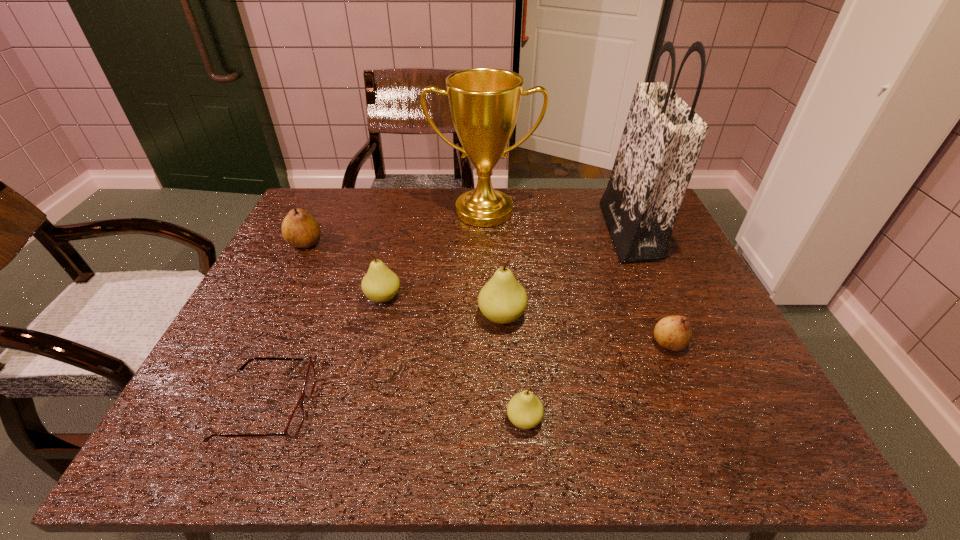
The image size is (960, 540). Find the location of `object identified as the closest to the award`. object identified as the closest to the award is located at coordinates pyautogui.click(x=662, y=139).

Locate an element on the screen. object that is the fifth nearest to the smallest green pear is located at coordinates (662, 139).

You are a GUI agent. You are given a task and a screenshot of the screen. Output one action in this format:
    pyautogui.click(x=<x>, y=<y>)
    Task: Click on the closest pear to the nearest green pear
    Image resolution: width=960 pixels, height=540 pixels.
    Given the screenshot: What is the action you would take?
    pyautogui.click(x=502, y=300)

This screenshot has height=540, width=960. I want to click on the closest pear to the spectacles, so click(380, 284).

Locate an element on the screen. The image size is (960, 540). the closest green pear to the sixth object from right to left is located at coordinates (502, 300).

Image resolution: width=960 pixels, height=540 pixels. Identify the location of the closest green pear to the nearest pear. (502, 300).

I want to click on vacant region that satisfies the following two spatial constraints: 1. on the front side of the right brown pear; 2. on the left side of the leftmost pear, so click(x=255, y=343).

Find the location of `vacant space that satisfies the following two spatial constraints: 1. by the handles of the biggest green pear; 2. on the right side of the gold award`. vacant space that satisfies the following two spatial constraints: 1. by the handles of the biggest green pear; 2. on the right side of the gold award is located at coordinates (485, 316).